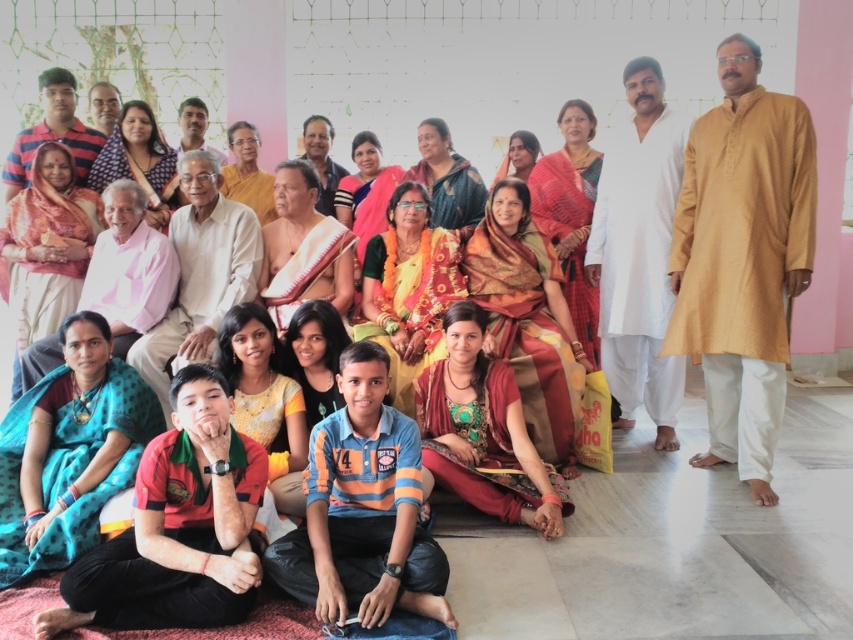
You are organizing a photo shoot and need to arrange the silky orange saree at center and the matte pink saree at lower left on a display stand. Based on the image, which saree should you place on the wider side of the stand to ensure proper display?

The silky orange saree at center might be wider than matte pink saree at lower left, so you should place it on the wider side of the stand to accommodate its width properly.